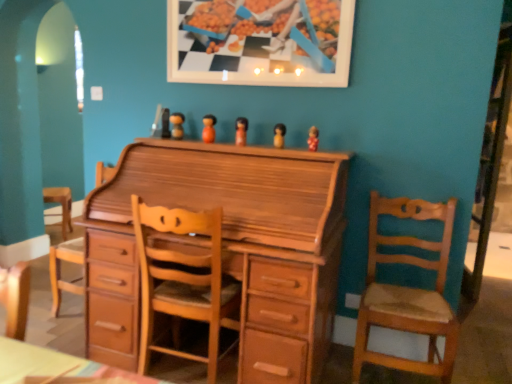
You are a GUI agent. You are given a task and a screenshot of the screen. Output one action in this format:
    pyautogui.click(x=<x>, y=<y>)
    Task: Click on the vacant point to the right of wooden figurine at center, which is the first toy from left to right
    The width and height of the screenshot is (512, 384).
    Given the screenshot: What is the action you would take?
    pyautogui.click(x=200, y=142)